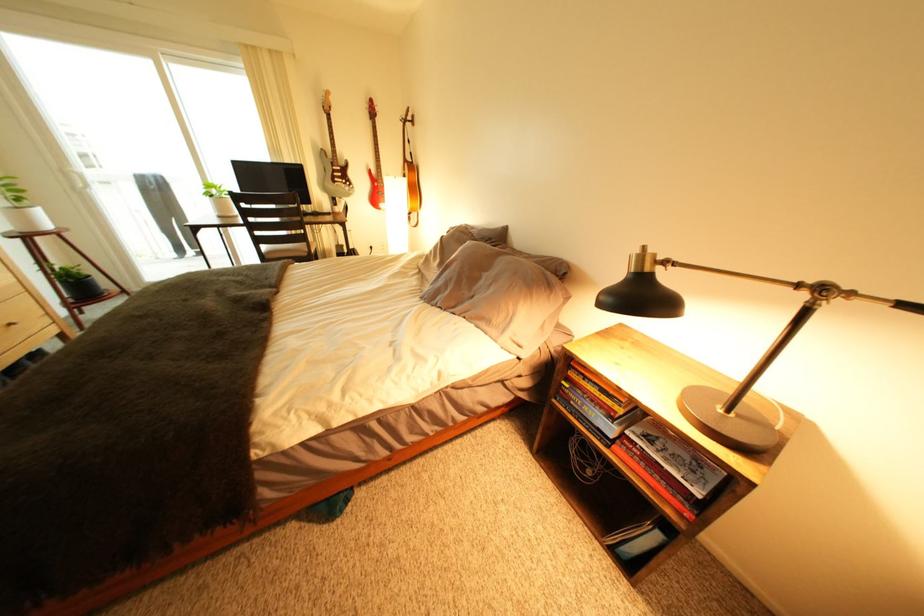
This screenshot has height=616, width=924. Find the location of `black lamp head`. black lamp head is located at coordinates (640, 292).